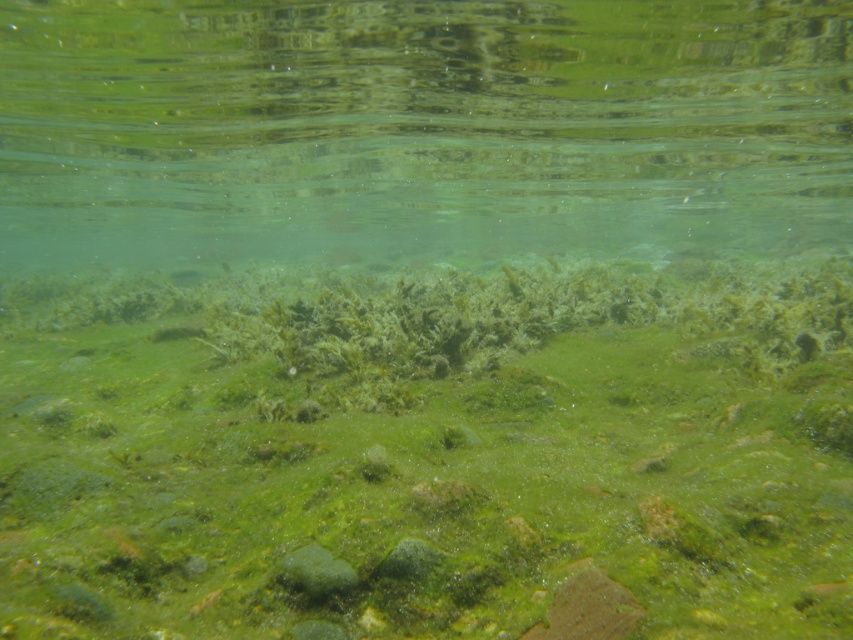
Looking at this image, you are a marine biologist studying underwater ecosystems. You observe the green algae at center and the green translucent water at center in the scene. Which of these two has a smaller width?

The green algae at center has a lesser width compared to the green translucent water at center, so the green algae at center is narrower.

You are a marine biologist studying underwater ecosystems. You observe the green algae at center and the green translucent water at center in the scene. Which of these two occupies a larger area in the underwater environment depicted?

The green translucent water at center occupies a larger area than the green algae at center, as stated in the description.

You are a marine biologist studying underwater ecosystems. You notice a point marked at coordinates [427,451] in the image. Based on the scene description, what is the most likely natural feature represented by this point?

The point at coordinates [427,451] most likely represents green algae at center, as stated in the Objects Description.